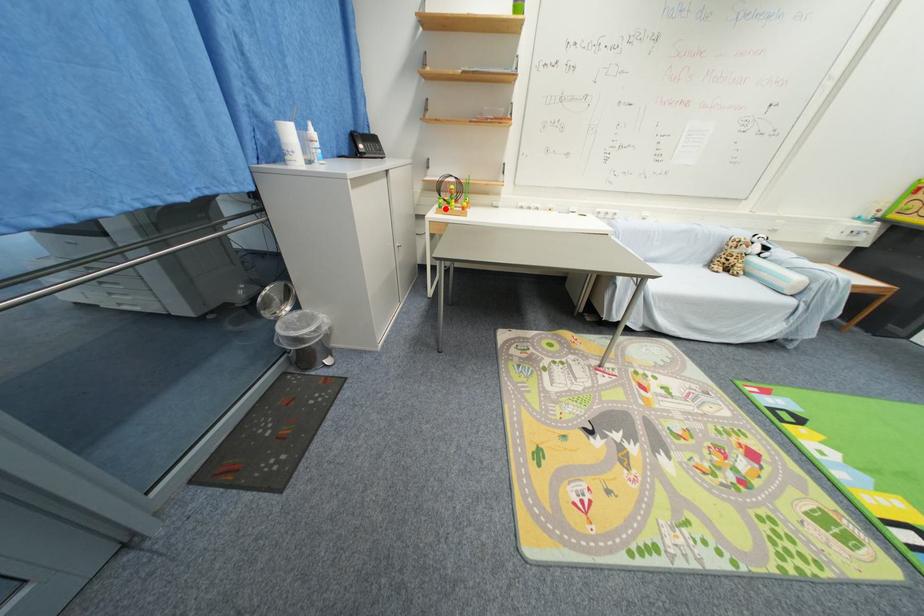
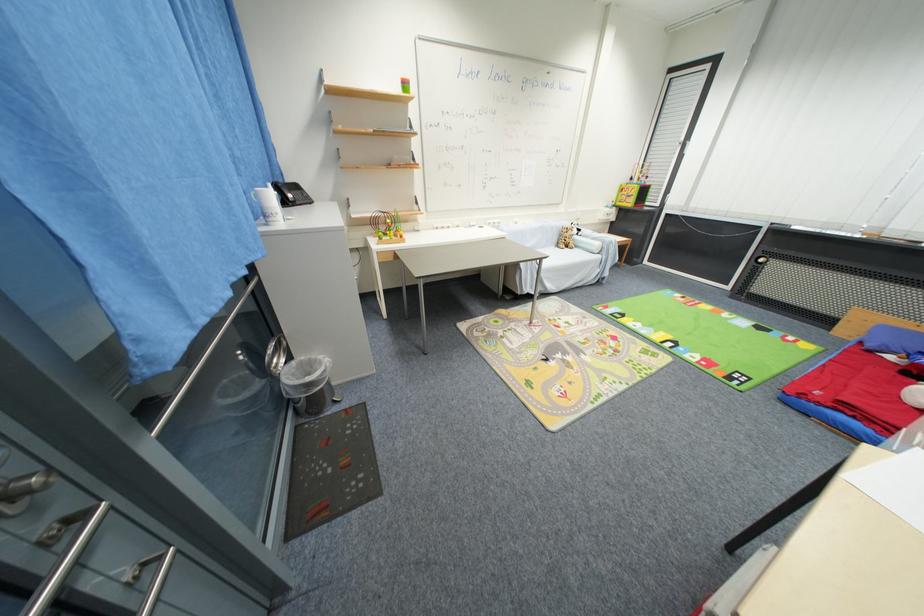
In the second image, find the point that corresponds to the highlighted location in the first image.

(385, 241)